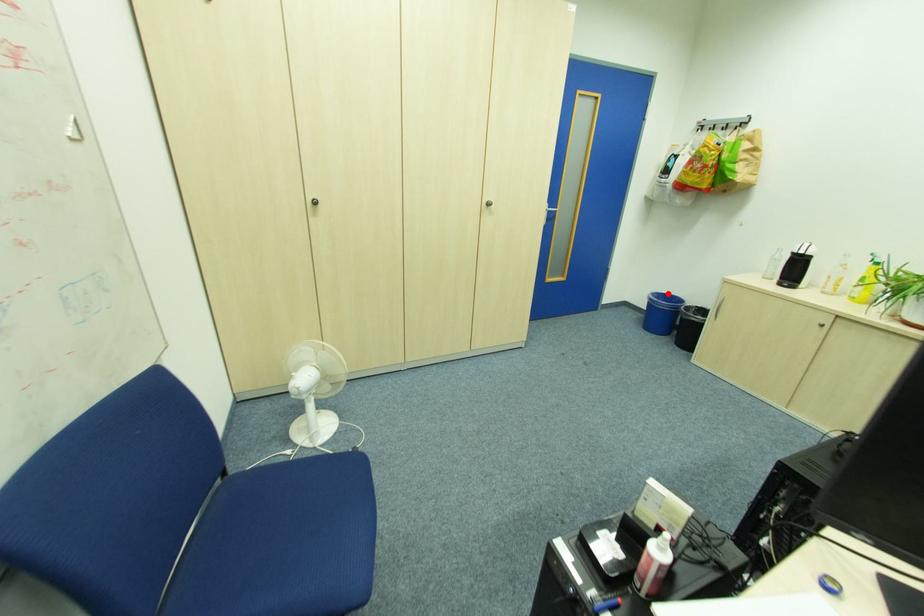
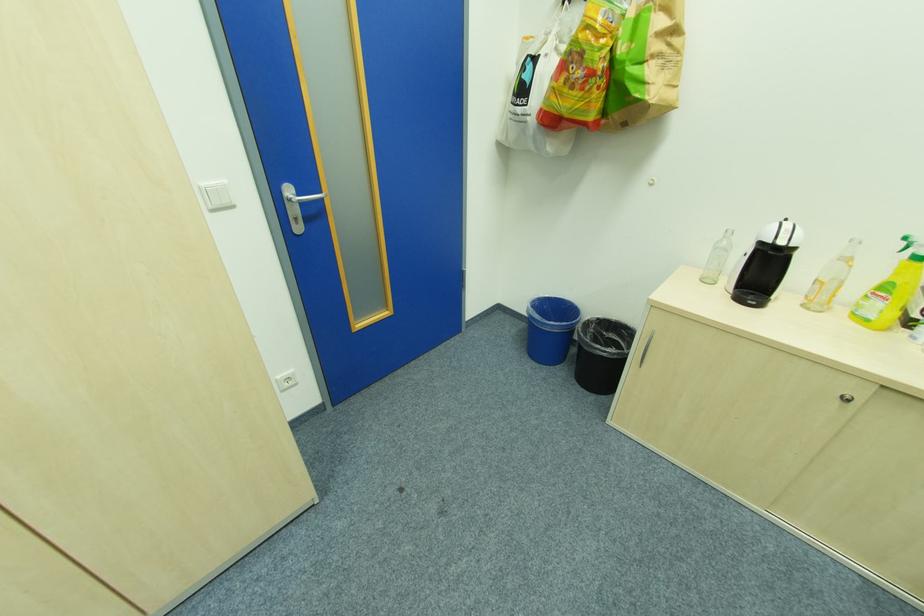
Find the pixel in the second image that matches the highlighted location in the first image.

(552, 297)